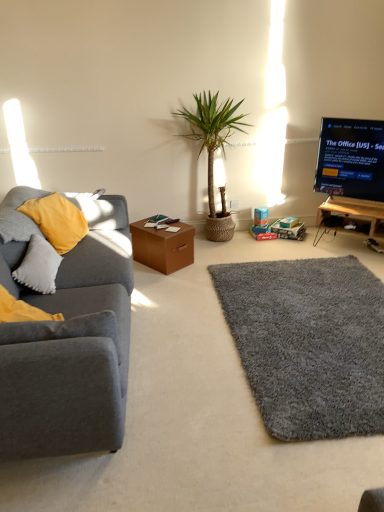
The width and height of the screenshot is (384, 512). What do you see at coordinates (351, 159) in the screenshot?
I see `black glossy tv at upper right` at bounding box center [351, 159].

Where is `matte gray couch at left`? The width and height of the screenshot is (384, 512). matte gray couch at left is located at coordinates (70, 348).

Is soft gray cushion at left outside of matte gray couch at left?

Actually, soft gray cushion at left is within matte gray couch at left.

Would you consider soft gray cushion at left to be distant from matte gray couch at left?

soft gray cushion at left is near matte gray couch at left, not far away.

Considering the positions of objects soft gray cushion at left and matte gray couch at left in the image provided, who is more to the left, soft gray cushion at left or matte gray couch at left?

soft gray cushion at left is more to the left.

Can you confirm if black glossy tv at upper right is positioned to the left of wooden tv stand at right?

Yes.

Is black glossy tv at upper right positioned beyond the bounds of wooden tv stand at right?

Absolutely, black glossy tv at upper right is external to wooden tv stand at right.

Considering the sizes of objects black glossy tv at upper right and wooden tv stand at right in the image provided, who is bigger, black glossy tv at upper right or wooden tv stand at right?

With larger size is black glossy tv at upper right.

Is black glossy tv at upper right placed right next to wooden tv stand at right?

No, black glossy tv at upper right is not beside wooden tv stand at right.

Consider the image. Is soft gray cushion at left next to wooden tv stand at right?

No, soft gray cushion at left is not in contact with wooden tv stand at right.

Is soft gray cushion at left completely or partially outside of wooden tv stand at right?

Indeed, soft gray cushion at left is completely outside wooden tv stand at right.

Looking at their sizes, would you say soft gray cushion at left is wider or thinner than wooden tv stand at right?

soft gray cushion at left is thinner than wooden tv stand at right.

Considering the sizes of objects soft gray cushion at left and wooden tv stand at right in the image provided, who is bigger, soft gray cushion at left or wooden tv stand at right?

Bigger between the two is wooden tv stand at right.

Is black glossy tv at upper right positioned beyond the bounds of gray shaggy rug at lower right?

Yes, black glossy tv at upper right is not within gray shaggy rug at lower right.

Between point (368, 192) and point (209, 266), which one is positioned behind?

The point (368, 192) is more distant.

From the image's perspective, does black glossy tv at upper right appear lower than gray shaggy rug at lower right?

No.

From a real-world perspective, which is physically above, black glossy tv at upper right or gray shaggy rug at lower right?

black glossy tv at upper right, from a real-world perspective.

Can you confirm if matte gray couch at left is positioned to the right of soft gray cushion at left?

Yes, matte gray couch at left is to the right of soft gray cushion at left.

Does matte gray couch at left have a larger size compared to soft gray cushion at left?

Indeed, matte gray couch at left has a larger size compared to soft gray cushion at left.

Is matte gray couch at left wider than soft gray cushion at left?

Indeed, matte gray couch at left has a greater width compared to soft gray cushion at left.

Is matte gray couch at left closer to camera compared to soft gray cushion at left?

Yes, it is.

Which is in front, point (354, 340) or point (133, 250)?

Positioned in front is point (354, 340).

Based on the photo, which is more to the right, gray shaggy rug at lower right or brown cardboard box at center?

Result: gray shaggy rug at lower right is more to the right.

From a real-world perspective, is gray shaggy rug at lower right positioned above or below brown cardboard box at center?

In terms of real-world spatial position, gray shaggy rug at lower right is below brown cardboard box at center.

Would you consider gray shaggy rug at lower right to be distant from brown cardboard box at center?

That's not correct — gray shaggy rug at lower right is a little close to brown cardboard box at center.

Is matte gray couch at left not within black glossy tv at upper right?

matte gray couch at left is positioned outside black glossy tv at upper right.

From the image's perspective, which is below, matte gray couch at left or black glossy tv at upper right?

matte gray couch at left, from the image's perspective.

Is matte gray couch at left turned away from black glossy tv at upper right?

That's not correct — matte gray couch at left is not looking away from black glossy tv at upper right.

Looking at the image, does matte gray couch at left seem bigger or smaller compared to black glossy tv at upper right?

Clearly, matte gray couch at left is larger in size than black glossy tv at upper right.

Find the location of a particular element. pillow that appears above the matte gray couch at left (from the image's perspective) is located at coordinates (39, 266).

Where is `television that is on the left side of wooden tv stand at right`? The width and height of the screenshot is (384, 512). television that is on the left side of wooden tv stand at right is located at coordinates (351, 159).

Considering their positions, is soft gray cushion at left positioned further to black glossy tv at upper right than gray shaggy rug at lower right?

The object further to black glossy tv at upper right is soft gray cushion at left.

From the image, which object appears to be farther from soft gray cushion at left, matte gray couch at left or wooden tv stand at right?

wooden tv stand at right lies further to soft gray cushion at left than the other object.

Considering their positions, is wooden tv stand at right positioned closer to soft gray cushion at left than matte gray couch at left?

matte gray couch at left is closer to soft gray cushion at left.

Looking at the image, which one is located further to matte gray couch at left, black glossy tv at upper right or brown cardboard box at center?

The object further to matte gray couch at left is black glossy tv at upper right.

Looking at the image, which one is located closer to brown cardboard box at center, soft gray cushion at left or gray shaggy rug at lower right?

Based on the image, gray shaggy rug at lower right appears to be nearer to brown cardboard box at center.

Estimate the real-world distances between objects in this image. Which object is further from gray shaggy rug at lower right, green woven basket at center or matte gray couch at left?

green woven basket at center lies further to gray shaggy rug at lower right than the other object.

From the image, which object appears to be farther from brown cardboard box at center, soft gray cushion at left or wooden tv stand at right?

wooden tv stand at right is positioned further to the anchor brown cardboard box at center.

Which object lies further to the anchor point green woven basket at center, wooden tv stand at right or brown cardboard box at center?

wooden tv stand at right is further to green woven basket at center.

You are a GUI agent. You are given a task and a screenshot of the screen. Output one action in this format:
    pyautogui.click(x=<x>, y=<y>)
    Task: Click on the mat located between soft gray cushion at left and black glossy tv at upper right in the left-right direction
    The height and width of the screenshot is (512, 384).
    Given the screenshot: What is the action you would take?
    click(x=308, y=343)

Where is `mat between matte gray couch at left and brown cardboard box at center along the z-axis`? This screenshot has height=512, width=384. mat between matte gray couch at left and brown cardboard box at center along the z-axis is located at coordinates (308, 343).

Where is `mat between brown cardboard box at center and wooden tv stand at right from left to right`? This screenshot has width=384, height=512. mat between brown cardboard box at center and wooden tv stand at right from left to right is located at coordinates (308, 343).

Locate an element on the screen. The image size is (384, 512). mat located between matte gray couch at left and green woven basket at center in the depth direction is located at coordinates (308, 343).